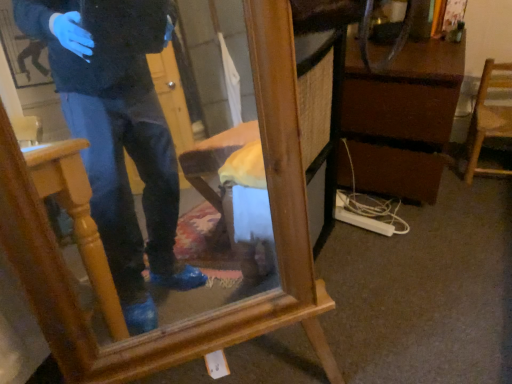
Image resolution: width=512 pixels, height=384 pixels. I want to click on free space in front of brown wood vanity at center right, so click(418, 241).